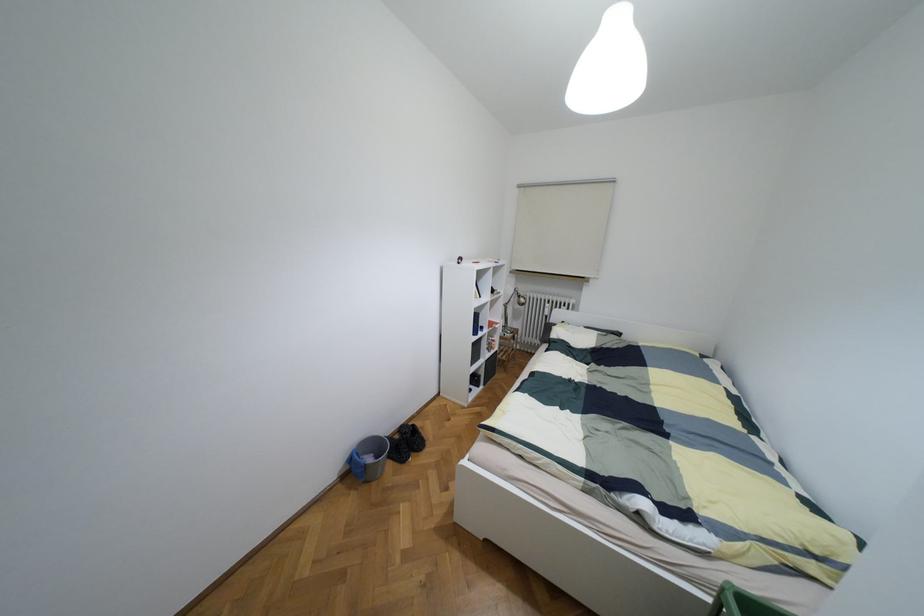
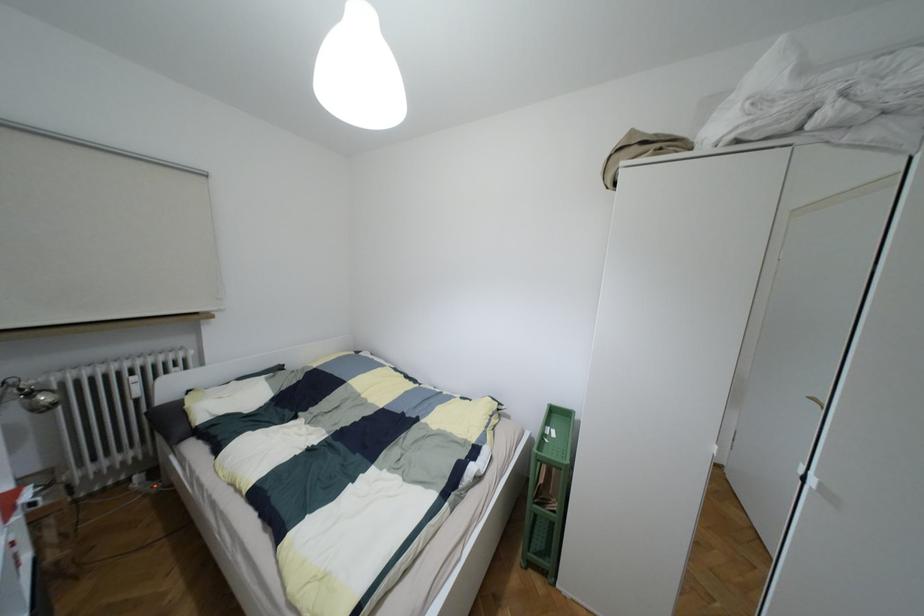
Question: How did the camera likely rotate?

Choices:
 (A) Left
 (B) Right
 (C) Up
 (D) Down

Answer: (B)